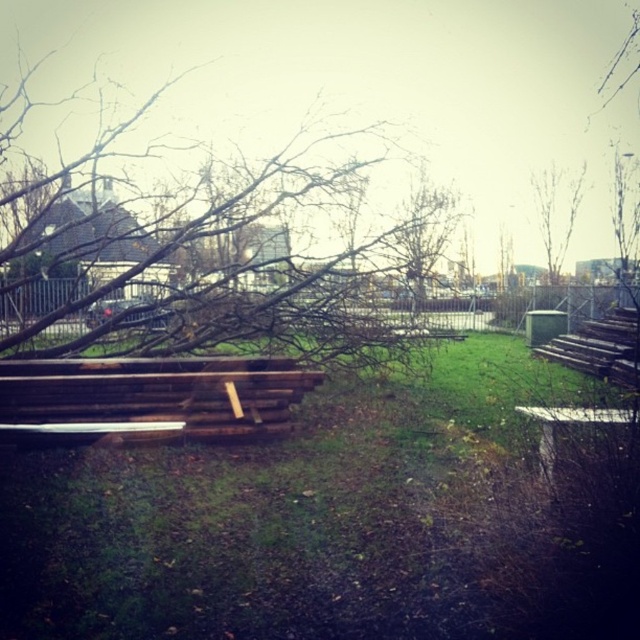
Can you confirm if brown wooden bench at center is shorter than bare branches at upper right?

Indeed, brown wooden bench at center has a lesser height compared to bare branches at upper right.

Is brown wooden bench at center wider than bare branches at upper right?

Yes.

I want to click on brown wooden bench at center, so click(148, 396).

Between brown wood tree at center and brown wooden bench at center, which one has more height?

brown wood tree at center

Who is more distant from viewer, (356,330) or (145,401)?

The point (356,330) is behind.

Which is in front, point (429, 257) or point (240, 388)?

Point (240, 388) is in front.

Where is `brown wood tree at center`? brown wood tree at center is located at coordinates (225, 252).

Is point (33, 353) positioned in front of point (556, 186)?

Yes, point (33, 353) is closer to viewer.

Which is in front, point (38, 253) or point (576, 173)?

Positioned in front is point (38, 253).

What are the coordinates of `brown wood tree at center` in the screenshot? It's located at (225, 252).